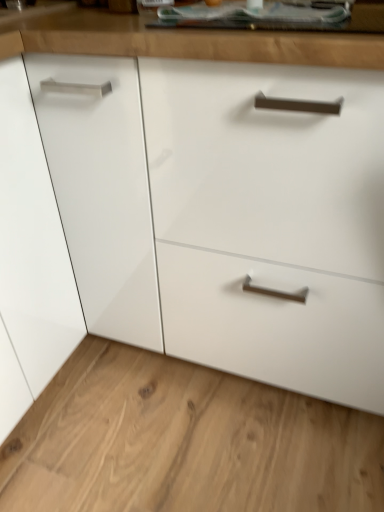
What is the approximate height of glossy wood counter top at upper center?

glossy wood counter top at upper center is 4.59 centimeters in height.

In order to click on glossy wood counter top at upper center in this screenshot , I will do `click(181, 41)`.

Describe the element at coordinates (181, 41) in the screenshot. The image size is (384, 512). I see `glossy wood counter top at upper center` at that location.

In order to face glossy wood counter top at upper center, should I rotate leftwards or rightwards?

Turn right by 12.184 degrees to look at glossy wood counter top at upper center.

You are a GUI agent. You are given a task and a screenshot of the screen. Output one action in this format:
    pyautogui.click(x=<x>, y=<y>)
    Task: Click on the white glossy drawer at lower right
    
    Given the screenshot: What is the action you would take?
    pyautogui.click(x=184, y=442)

Image resolution: width=384 pixels, height=512 pixels. What do you see at coordinates (184, 442) in the screenshot?
I see `white glossy drawer at lower right` at bounding box center [184, 442].

The image size is (384, 512). Find the location of `glossy wood counter top at upper center`. glossy wood counter top at upper center is located at coordinates (181, 41).

Which is more to the left, glossy wood counter top at upper center or white glossy drawer at lower right?

white glossy drawer at lower right.

Which is behind, glossy wood counter top at upper center or white glossy drawer at lower right?

white glossy drawer at lower right.

Which is behind, point (167, 39) or point (304, 410)?

The point (304, 410) is more distant.

From the image's perspective, is glossy wood counter top at upper center located above white glossy drawer at lower right?

Yes, from the image's perspective, glossy wood counter top at upper center is above white glossy drawer at lower right.

From a real-world perspective, is glossy wood counter top at upper center positioned under white glossy drawer at lower right based on gravity?

No, from a real-world perspective, glossy wood counter top at upper center is not under white glossy drawer at lower right.

Between glossy wood counter top at upper center and white glossy drawer at lower right, which one has larger width?

Wider between the two is white glossy drawer at lower right.

Is glossy wood counter top at upper center shorter than white glossy drawer at lower right?

In fact, glossy wood counter top at upper center may be taller than white glossy drawer at lower right.

In the scene shown: Based on their sizes in the image, would you say glossy wood counter top at upper center is bigger or smaller than white glossy drawer at lower right?

Considering their sizes, glossy wood counter top at upper center takes up less space than white glossy drawer at lower right.

Is glossy wood counter top at upper center situated inside white glossy drawer at lower right or outside?

glossy wood counter top at upper center lies outside white glossy drawer at lower right.

Are glossy wood counter top at upper center and white glossy drawer at lower right located far from each other?

No.

Could you tell me if glossy wood counter top at upper center is facing white glossy drawer at lower right?

No, glossy wood counter top at upper center is not turned towards white glossy drawer at lower right.

How distant is glossy wood counter top at upper center from white glossy drawer at lower right?

They are 35.68 inches apart.

Locate an element on the screen. The height and width of the screenshot is (512, 384). plain behind the glossy wood counter top at upper center is located at coordinates (184, 442).

Is white glossy drawer at lower right to the right of glossy wood counter top at upper center from the viewer's perspective?

No.

Is white glossy drawer at lower right further to the viewer compared to glossy wood counter top at upper center?

Yes, the depth of white glossy drawer at lower right is greater than that of glossy wood counter top at upper center.

Does point (294, 471) come in front of point (357, 40)?

No, (294, 471) is behind (357, 40).

From the image's perspective, is white glossy drawer at lower right located above glossy wood counter top at upper center?

No, from the image's perspective, white glossy drawer at lower right is not on top of glossy wood counter top at upper center.

From a real-world perspective, between white glossy drawer at lower right and glossy wood counter top at upper center, who is vertically lower?

From a 3D spatial view, white glossy drawer at lower right is below.

Can you confirm if white glossy drawer at lower right is thinner than glossy wood counter top at upper center?

No.

Considering the relative sizes of white glossy drawer at lower right and glossy wood counter top at upper center in the image provided, is white glossy drawer at lower right taller than glossy wood counter top at upper center?

No, white glossy drawer at lower right is not taller than glossy wood counter top at upper center.

Does white glossy drawer at lower right have a smaller size compared to glossy wood counter top at upper center?

No, white glossy drawer at lower right is not smaller than glossy wood counter top at upper center.

Is white glossy drawer at lower right inside the boundaries of glossy wood counter top at upper center, or outside?

white glossy drawer at lower right lies outside glossy wood counter top at upper center.

Would you say white glossy drawer at lower right is a long distance from glossy wood counter top at upper center?

white glossy drawer at lower right is actually quite close to glossy wood counter top at upper center.

Could you tell me if white glossy drawer at lower right is turned towards glossy wood counter top at upper center?

No, white glossy drawer at lower right is not oriented towards glossy wood counter top at upper center.

Find the location of a particular element. counter top above the white glossy drawer at lower right (from a real-world perspective) is located at coordinates (181, 41).

You are a GUI agent. You are given a task and a screenshot of the screen. Output one action in this format:
    pyautogui.click(x=<x>, y=<y>)
    Task: Click on the plain below the glossy wood counter top at upper center (from a real-world perspective)
    
    Given the screenshot: What is the action you would take?
    pyautogui.click(x=184, y=442)

Find the location of a particular element. The width and height of the screenshot is (384, 512). counter top above the white glossy drawer at lower right (from a real-world perspective) is located at coordinates (181, 41).